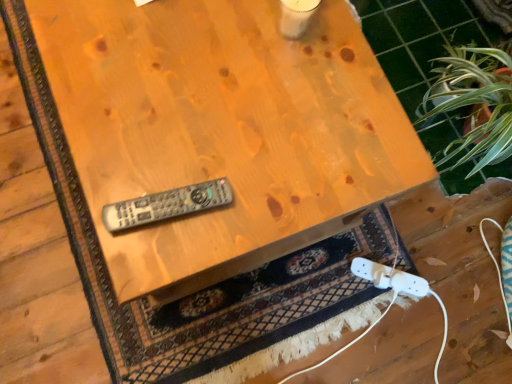
The image size is (512, 384). In order to click on free location to the left of gray plastic remote at center in this screenshot , I will do `click(110, 156)`.